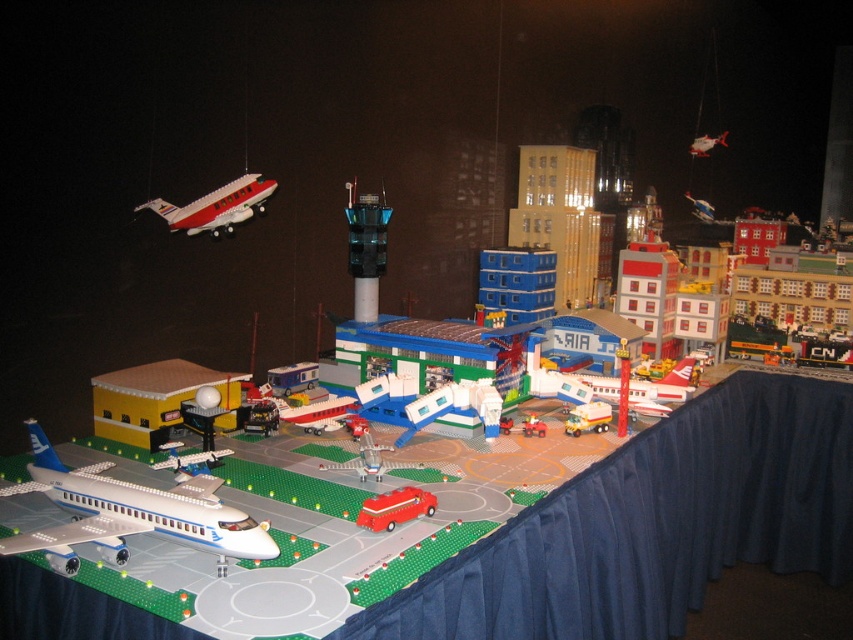
Question: Does rubber fire truck at center have a smaller size compared to red plastic car at center?

Choices:
 (A) no
 (B) yes

Answer: (A)

Question: Is red glossy airplane at upper left positioned before red plastic car at center?

Choices:
 (A) no
 (B) yes

Answer: (B)

Question: Can you confirm if blue fabric tablecloth at lower right is thinner than red glossy airplane at upper left?

Choices:
 (A) no
 (B) yes

Answer: (A)

Question: Which point is farther from the camera taking this photo?

Choices:
 (A) click(x=251, y=176)
 (B) click(x=380, y=497)

Answer: (A)

Question: Based on their relative distances, which object is nearer to the rubber fire truck at center?

Choices:
 (A) red plastic car at center
 (B) matte white truck at center

Answer: (A)

Question: Which point is farther from the camera taking this photo?

Choices:
 (A) (357, 515)
 (B) (96, 524)

Answer: (A)